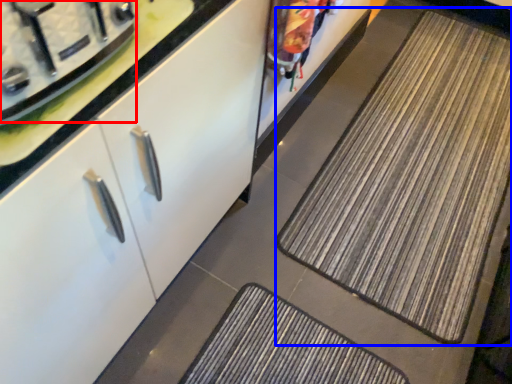
Question: Which point is further to the camera, appliance (highlighted by a red box) or mat (highlighted by a blue box)?

Choices:
 (A) appliance
 (B) mat

Answer: (B)